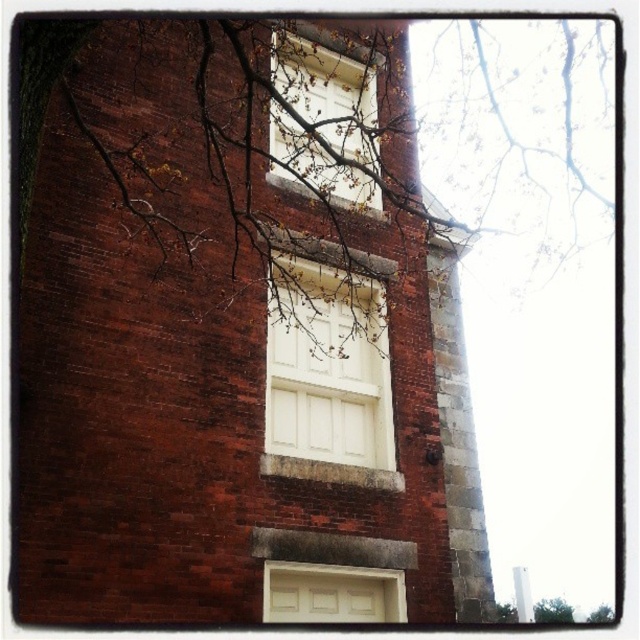
Question: Estimate the real-world distances between objects in this image. Which object is closer to the bare branches at upper center?

Choices:
 (A) green leafy tree at lower right
 (B) white matte door at center

Answer: (B)

Question: Is white matte door at center behind bare branches at lower right?

Choices:
 (A) no
 (B) yes

Answer: (A)

Question: Which point is closer to the camera taking this photo?

Choices:
 (A) (572, 612)
 (B) (605, 618)

Answer: (A)

Question: Is white matte window at upper center positioned at the back of bare branches at lower right?

Choices:
 (A) no
 (B) yes

Answer: (A)

Question: Is white matte door at center thinner than green leafy tree at lower right?

Choices:
 (A) no
 (B) yes

Answer: (B)

Question: Considering the real-world distances, which object is closest to the white matte door at center?

Choices:
 (A) bare branches at lower right
 (B) green leafy tree at lower right
 (C) white matte window at upper center
 (D) bare branches at upper center

Answer: (D)